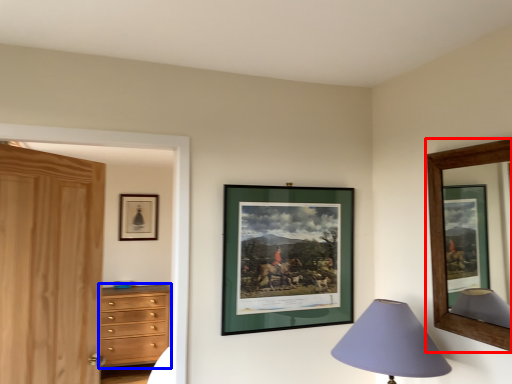
Question: Among these objects, which one is nearest to the camera, picture frame (highlighted by a red box) or chest of drawers (highlighted by a blue box)?

Choices:
 (A) picture frame
 (B) chest of drawers

Answer: (A)